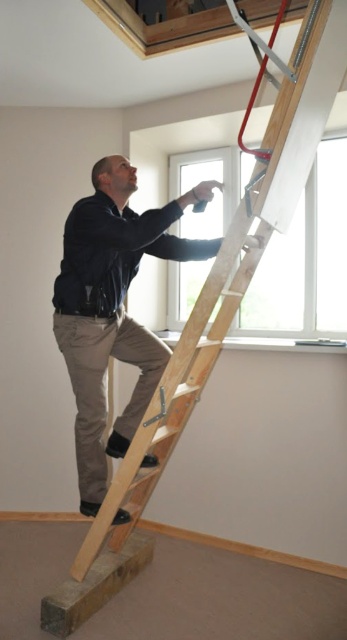
In the scene shown: Is dark brown leather jacket at upper center closer to the viewer compared to wooden ladder at center?

No, it is not.

Based on the photo, is dark brown leather jacket at upper center taller than wooden ladder at center?

In fact, dark brown leather jacket at upper center may be shorter than wooden ladder at center.

I want to click on dark brown leather jacket at upper center, so click(113, 308).